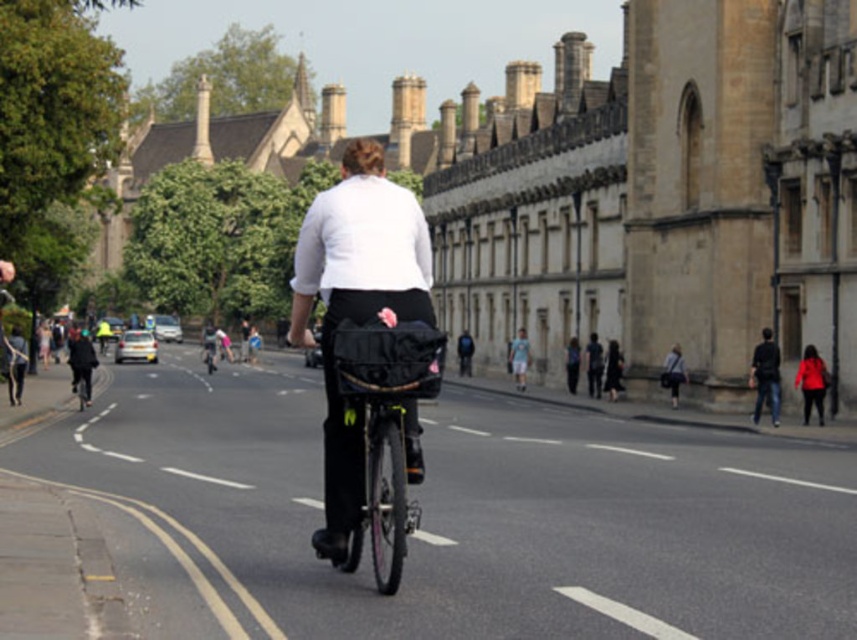
Between white matte shirt at center and matte red coat at lower right, which one appears on the left side from the viewer's perspective?

white matte shirt at center is more to the left.

Is white matte shirt at center positioned at the back of matte red coat at lower right?

That is False.

The height and width of the screenshot is (640, 857). Find the location of `white matte shirt at center`. white matte shirt at center is located at coordinates (355, 304).

Which is more to the left, white matte shirt at center or black matte bicycle at center?

white matte shirt at center

Does white matte shirt at center appear under black matte bicycle at center?

Actually, white matte shirt at center is above black matte bicycle at center.

The image size is (857, 640). Identify the location of white matte shirt at center. (355, 304).

Who is higher up, white matte shirt at center or dark blue jeans at right?

white matte shirt at center is above.

This screenshot has height=640, width=857. What do you see at coordinates (355, 304) in the screenshot? I see `white matte shirt at center` at bounding box center [355, 304].

Is point (412, 298) farther from viewer compared to point (777, 376)?

No.

Locate an element on the screen. white matte shirt at center is located at coordinates (355, 304).